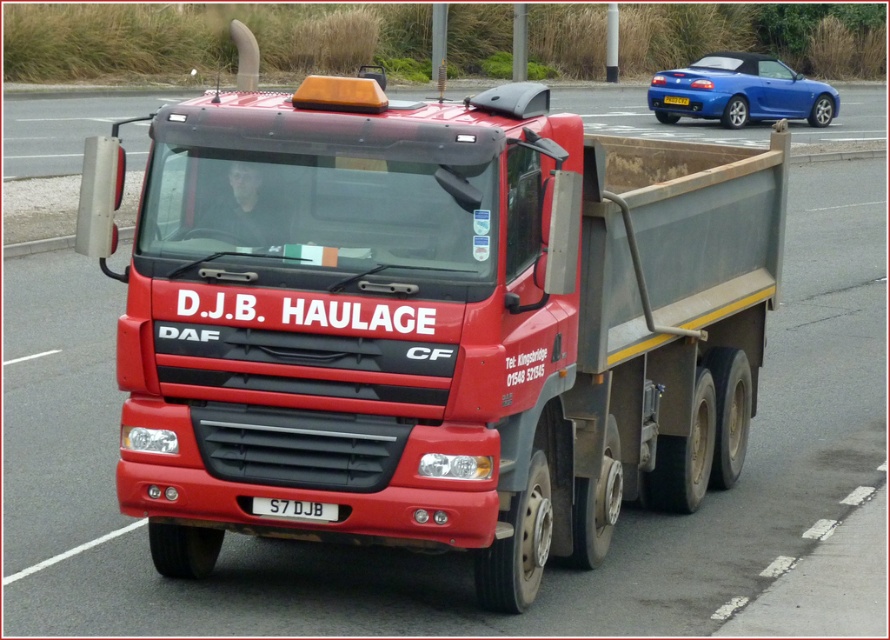
Question: Is matte red truck at center to the left of blue metallic car at upper right from the viewer's perspective?

Choices:
 (A) yes
 (B) no

Answer: (A)

Question: From the image, what is the correct spatial relationship of matte red truck at center in relation to white plastic license plate at center?

Choices:
 (A) left
 (B) right

Answer: (B)

Question: Which object appears closest to the camera in this image?

Choices:
 (A) matte red truck at center
 (B) white plastic license plate at center
 (C) blue metallic car at upper right

Answer: (B)

Question: Which object is closer to the camera taking this photo?

Choices:
 (A) blue metallic car at upper right
 (B) white plastic license plate at center
 (C) matte red truck at center

Answer: (B)

Question: Which object appears farthest from the camera in this image?

Choices:
 (A) blue metallic car at upper right
 (B) white plastic license plate at center

Answer: (A)

Question: Is matte red truck at center above white plastic license plate at center?

Choices:
 (A) no
 (B) yes

Answer: (B)